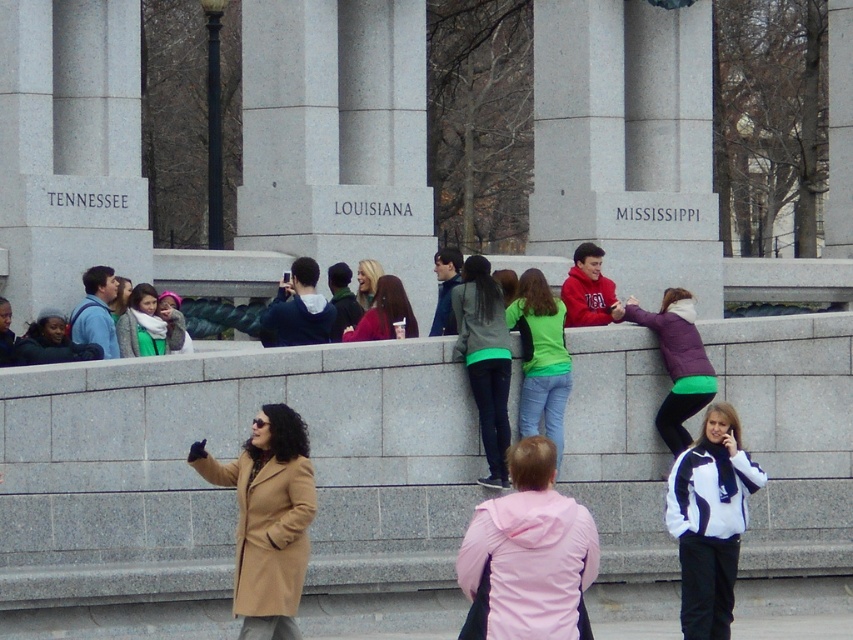
Question: Estimate the real-world distances between objects in this image. Which object is farther from the green matte shirt at center?

Choices:
 (A) matte pink hoodie at center
 (B) matte green scarf at center
 (C) matte blue jacket at center
 (D) purple fleece jacket at upper right

Answer: (B)

Question: Does tan coat at center lie behind matte black jacket at lower left?

Choices:
 (A) no
 (B) yes

Answer: (A)

Question: Estimate the real-world distances between objects in this image. Which object is closer to the blonde hair at center?

Choices:
 (A) white stone tennessee at left
 (B) green fabric jacket at center
 (C) matte black jacket at lower left
 (D) purple fleece jacket at upper right

Answer: (B)

Question: Can you confirm if gray concrete ledge at center is bigger than matte green scarf at center?

Choices:
 (A) yes
 (B) no

Answer: (A)

Question: Can you confirm if gray concrete ledge at center is wider than tan coat at center?

Choices:
 (A) no
 (B) yes

Answer: (B)

Question: Which is nearer to the gray concrete ledge at center?

Choices:
 (A) green fabric jacket at center
 (B) white marble pillar at center
 (C) white stone tennessee at left

Answer: (A)